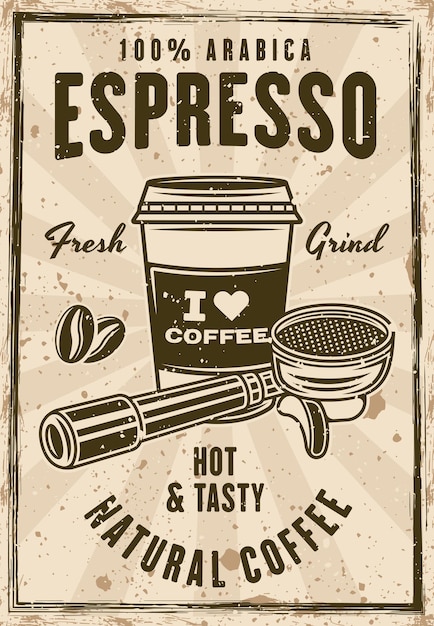
You are a GUI agent. You are given a task and a screenshot of the screen. Output one action in this format:
    pyautogui.click(x=<x>, y=<y>)
    Task: Click on the handle
    
    Given the screenshot: What is the action you would take?
    pyautogui.click(x=130, y=434)